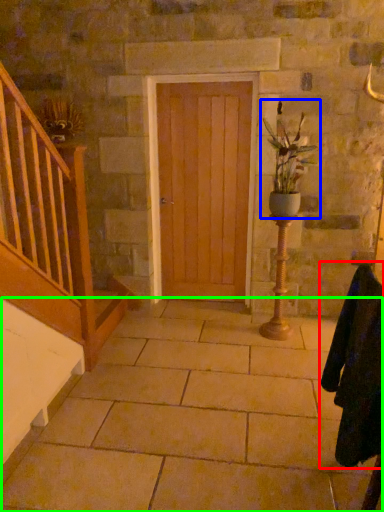
Question: Considering the real-world distances, which object is closest to robe (highlighted by a red box)? houseplant (highlighted by a blue box) or concrete (highlighted by a green box).

Choices:
 (A) houseplant
 (B) concrete

Answer: (B)